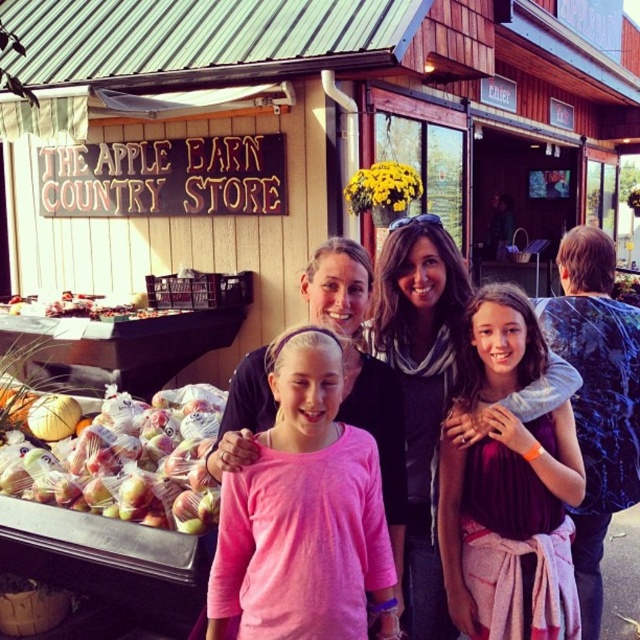
You are a photographer taking a picture of the scene outside The Apple Barn Country Store. You notice the pink fabric shirt at center and the shiny plastic apples at lower left. Which object appears narrower in the photo?

The pink fabric shirt at center appears narrower than the shiny plastic apples at lower left because it has a lesser width compared to them.

You are standing at the entrance of The Apple Barn Country Store and want to take a photo of the person wearing the pink cotton shirt at center. Where should you aim your camera to capture them in the frame?

You should aim your camera at point (305,508) to capture the person wearing the pink cotton shirt at center in the frame.

You are a photographer trying to capture a closeup of the black scarf at center and the translucent plastic bags of apples at lower left. Since you can only focus on one object at a time, which one should you choose to ensure it fits entirely within your camera frame?

The black scarf at center has a smaller width than the translucent plastic bags of apples at lower left. Therefore, to ensure it fits entirely within your camera frame, you should focus on the black scarf at center.